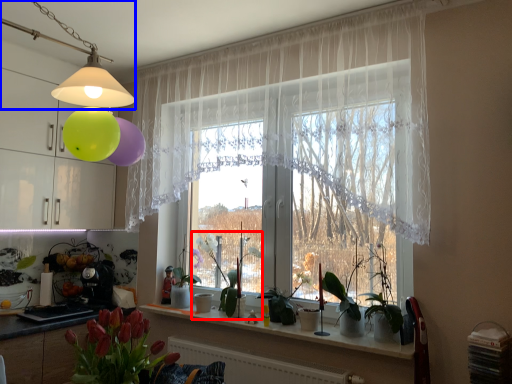
Question: Among these objects, which one is farthest to the camera, plant (highlighted by a red box) or lamp (highlighted by a blue box)?

Choices:
 (A) plant
 (B) lamp

Answer: (A)